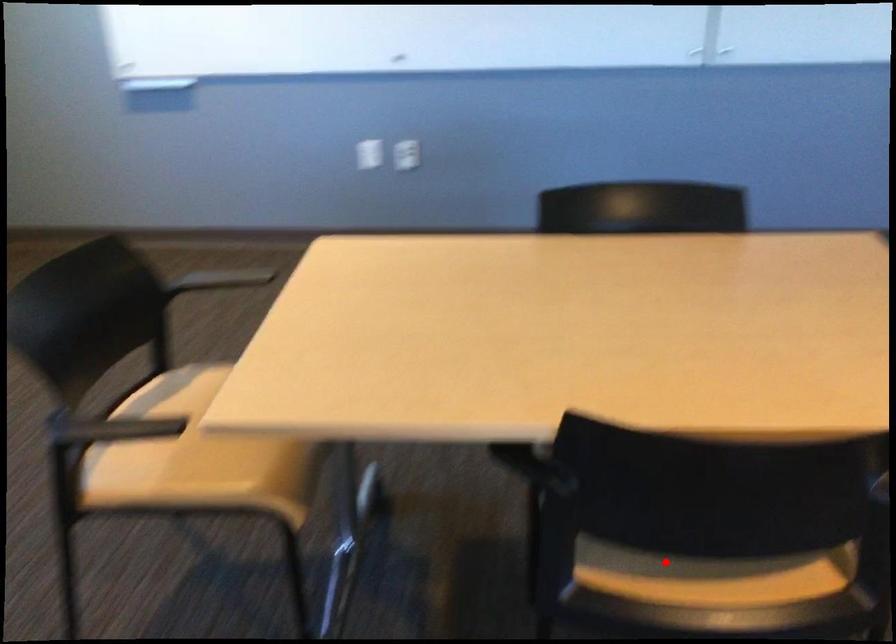
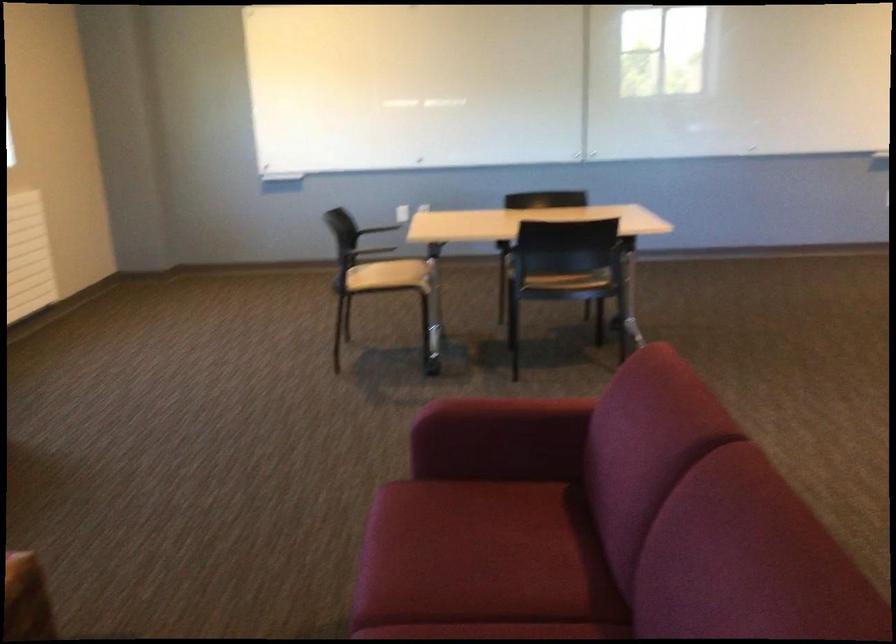
The point at the highlighted location is marked in the first image. Where is the corresponding point in the second image?

(566, 281)